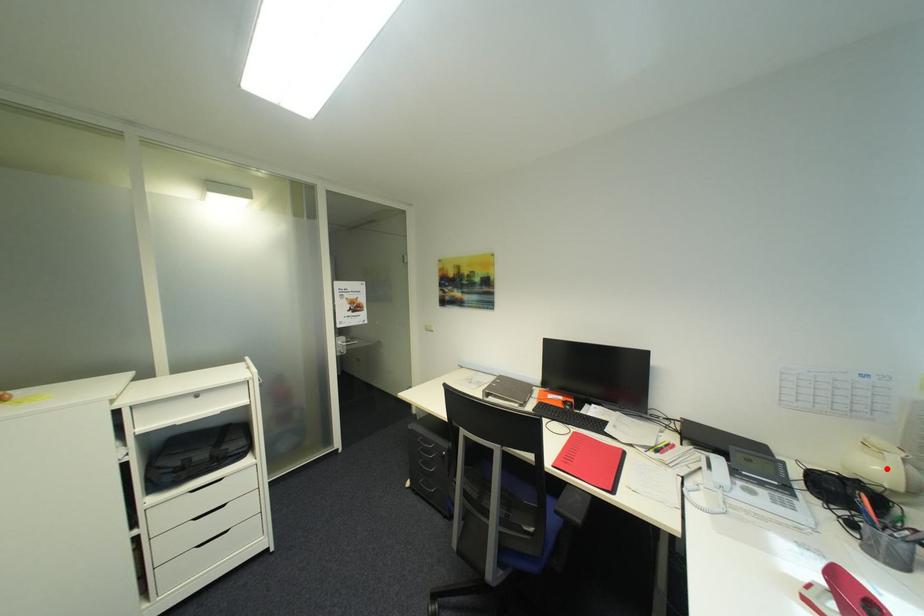
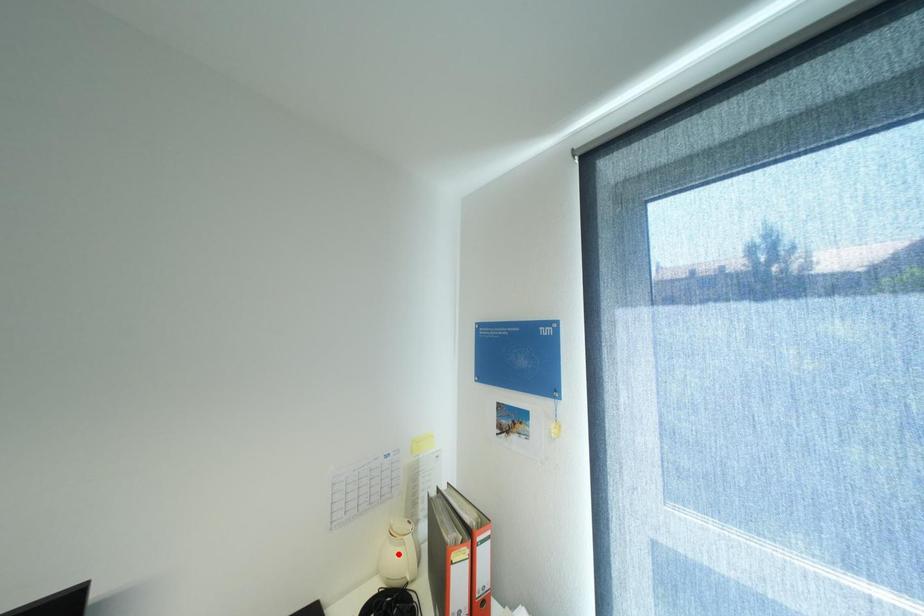
I am providing you with two images of the same scene from different viewpoints. A red point is marked on the first image and another point is marked on the second image. Is the marked point in image1 the same physical position as the marked point in image2?

No